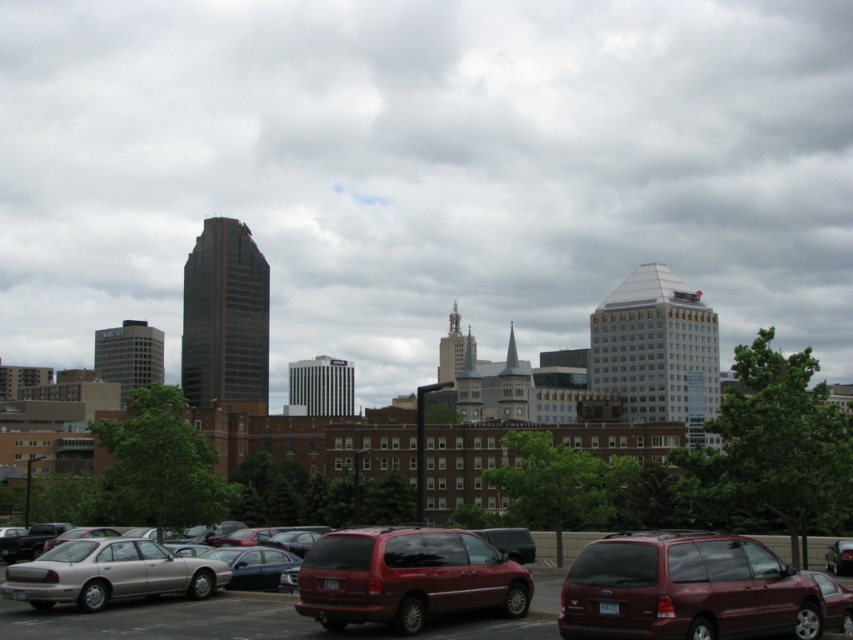
Question: Does maroon matte minivan at center appear over metallic silver car at lower left?

Choices:
 (A) yes
 (B) no

Answer: (A)

Question: Can you confirm if shiny maroon minivan at center is bigger than metallic silver car at lower left?

Choices:
 (A) no
 (B) yes

Answer: (A)

Question: Which point is closer to the camera?

Choices:
 (A) (827, 557)
 (B) (228, 580)
 (C) (738, 580)

Answer: (C)

Question: Which point appears farthest from the camera in this image?

Choices:
 (A) (73, 568)
 (B) (851, 556)
 (C) (320, 637)
 (D) (618, 621)

Answer: (B)

Question: Does shiny maroon minivan at center appear over silver metallic sedan at lower left?

Choices:
 (A) yes
 (B) no

Answer: (A)

Question: Among these objects, which one is farthest from the camera?

Choices:
 (A) maroon matte minivan at center
 (B) silver metallic sedan at lower left

Answer: (B)